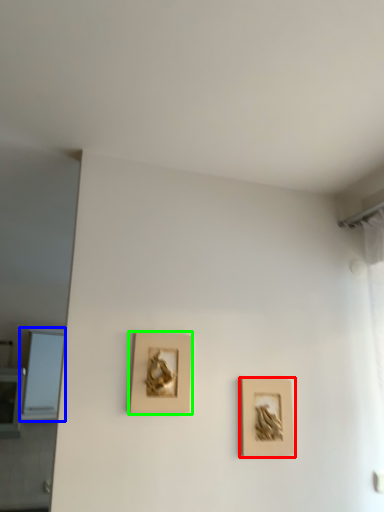
Question: Which is nearer to the picture frame (highlighted by a red box)? window (highlighted by a blue box) or picture frame (highlighted by a green box).

Choices:
 (A) window
 (B) picture frame

Answer: (B)